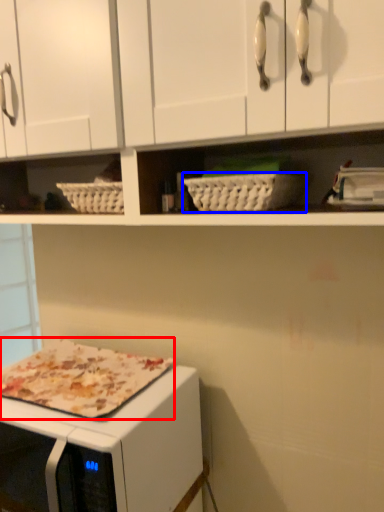
Question: Which object is closer to the camera taking this photo, pizza (highlighted by a red box) or basket (highlighted by a blue box)?

Choices:
 (A) pizza
 (B) basket

Answer: (B)